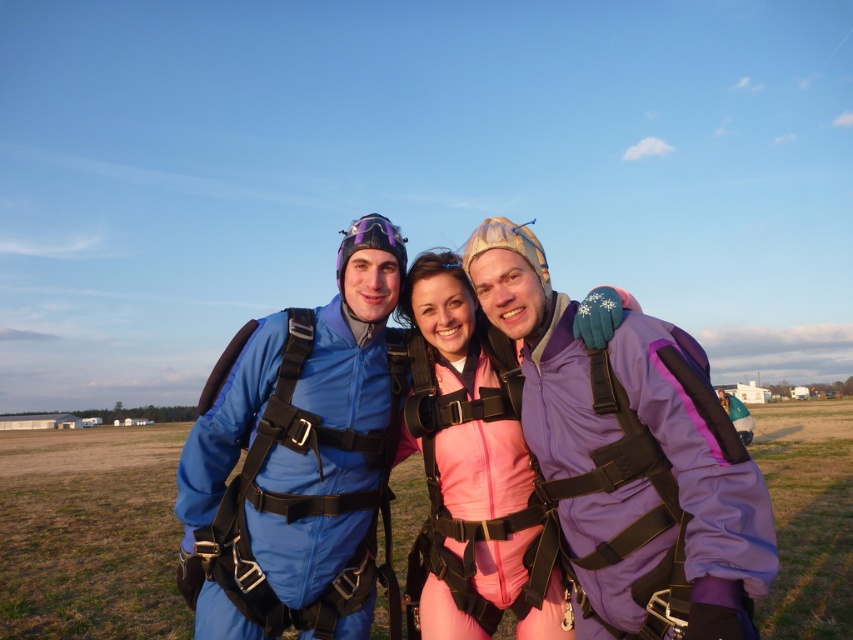
Question: Is pink fabric jumpsuit at center wider than purple matte/glossy goggles at center?

Choices:
 (A) yes
 (B) no

Answer: (B)

Question: Which point appears closest to the camera in this image?

Choices:
 (A) (531, 285)
 (B) (403, 250)
 (C) (312, 472)

Answer: (A)

Question: Which point is closer to the camera taking this photo?

Choices:
 (A) (276, 563)
 (B) (704, 474)

Answer: (B)

Question: Is matte blue jumpsuit at center below purple matte jumpsuit at center?

Choices:
 (A) yes
 (B) no

Answer: (A)

Question: Among these objects, which one is farthest from the camera?

Choices:
 (A) purple matte/glossy goggles at center
 (B) purple matte jumpsuit at center
 (C) pink fabric jumpsuit at center
 (D) matte blue jumpsuit at center

Answer: (A)

Question: Does matte blue jumpsuit at center have a larger size compared to purple matte jumpsuit at center?

Choices:
 (A) yes
 (B) no

Answer: (B)